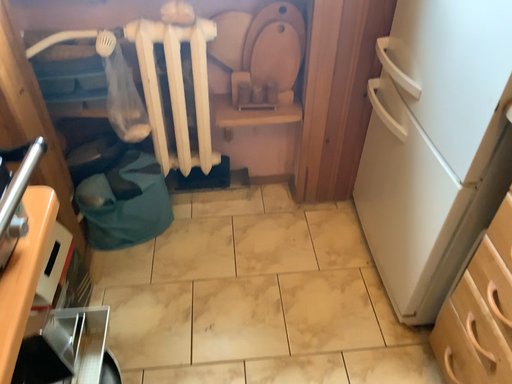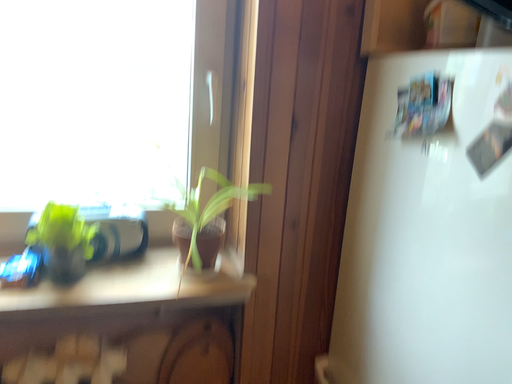
Question: How did the camera likely rotate when shooting the video?

Choices:
 (A) rotated right
 (B) rotated left

Answer: (A)